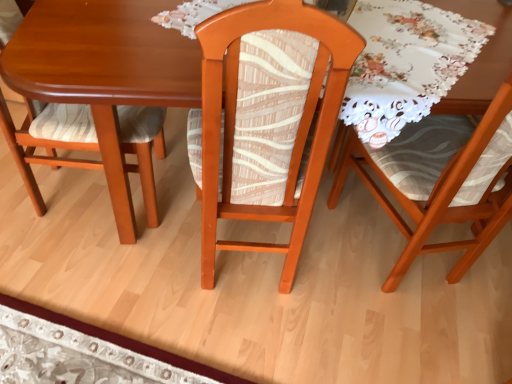
Measure the distance between point [471,220] and camera.

4.64 feet.

The width and height of the screenshot is (512, 384). Describe the element at coordinates (442, 180) in the screenshot. I see `wooden chair at right, positioned as the 1th chair in right-to-left order` at that location.

Identify the location of wooden table at center. This screenshot has height=384, width=512. (104, 70).

Describe the element at coordinates (141, 147) in the screenshot. The height and width of the screenshot is (384, 512). I see `matte wood chair at left, the 1th chair in the left-to-right sequence` at that location.

The image size is (512, 384). Find the location of `wooden chair at right, positioned as the 1th chair in right-to-left order`. wooden chair at right, positioned as the 1th chair in right-to-left order is located at coordinates (442, 180).

From a real-world perspective, is wooden chair at center, which appears as the second chair when viewed from the right, above or below wooden chair at right, which ranks as the 3th chair in left-to-right order?

wooden chair at center, which appears as the second chair when viewed from the right, is situated lower than wooden chair at right, which ranks as the 3th chair in left-to-right order, in the real world.

Consider the image. Is wooden chair at center, which appears as the second chair when viewed from the right, beside wooden chair at right, which ranks as the 3th chair in left-to-right order?

No, wooden chair at center, which appears as the second chair when viewed from the right, is not in contact with wooden chair at right, which ranks as the 3th chair in left-to-right order.

How different are the orientations of wooden chair at center, which appears as the second chair when viewed from the right, and wooden chair at right, which ranks as the 3th chair in left-to-right order, in degrees?

12 degrees.

From the image's perspective, which object appears higher, wooden table at center or matte wood chair at left, positioned as the 3th chair in right-to-left order?

From the image's view, wooden table at center is above.

Is wooden table at center not near matte wood chair at left, positioned as the 3th chair in right-to-left order?

No, wooden table at center is not far away from matte wood chair at left, positioned as the 3th chair in right-to-left order.

Is wooden table at center at the right side of matte wood chair at left, positioned as the 3th chair in right-to-left order?

Correct, you'll find wooden table at center to the right of matte wood chair at left, positioned as the 3th chair in right-to-left order.

In the scene shown: Is wooden table at center shorter than matte wood chair at left, the 1th chair in the left-to-right sequence?

Yes, wooden table at center is shorter than matte wood chair at left, the 1th chair in the left-to-right sequence.

Consider the image. From the image's perspective, is wooden table at center positioned above or below wooden chair at right, which ranks as the 3th chair in left-to-right order?

From the image's perspective, wooden table at center appears above wooden chair at right, which ranks as the 3th chair in left-to-right order.

Which object is more forward, wooden table at center or wooden chair at right, positioned as the 1th chair in right-to-left order?

wooden chair at right, positioned as the 1th chair in right-to-left order.

Which of these two, wooden table at center or wooden chair at right, positioned as the 1th chair in right-to-left order, is smaller?

With smaller size is wooden table at center.

Is matte wood chair at left, the 1th chair in the left-to-right sequence, shorter than wooden table at center?

No, matte wood chair at left, the 1th chair in the left-to-right sequence, is not shorter than wooden table at center.

Considering the positions of objects matte wood chair at left, the 1th chair in the left-to-right sequence, and wooden table at center in the image provided, who is more to the left, matte wood chair at left, the 1th chair in the left-to-right sequence, or wooden table at center?

Positioned to the left is matte wood chair at left, the 1th chair in the left-to-right sequence.

Is matte wood chair at left, the 1th chair in the left-to-right sequence, positioned with its back to wooden table at center?

That's not correct — matte wood chair at left, the 1th chair in the left-to-right sequence, is not looking away from wooden table at center.

Which is in front, matte wood chair at left, positioned as the 3th chair in right-to-left order, or wooden table at center?

wooden table at center is closer to the camera.

Considering the points (175, 80) and (302, 50), which point is in front, point (175, 80) or point (302, 50)?

Positioned in front is point (302, 50).

Can you confirm if wooden table at center is positioned to the right of wooden chair at center, which appears as the second chair when viewed from the right?

Yes, wooden table at center is to the right of wooden chair at center, which appears as the second chair when viewed from the right.

Who is smaller, wooden table at center or wooden chair at center, marked as the second chair in a left-to-right arrangement?

Smaller between the two is wooden table at center.

From the image's perspective, is wooden table at center below wooden chair at center, which appears as the second chair when viewed from the right?

No, from the image's perspective, wooden table at center is not below wooden chair at center, which appears as the second chair when viewed from the right.

Who is bigger, wooden chair at center, marked as the second chair in a left-to-right arrangement, or wooden table at center?

wooden chair at center, marked as the second chair in a left-to-right arrangement, is bigger.

Which object is closer to the camera, wooden chair at center, marked as the second chair in a left-to-right arrangement, or wooden table at center?

Positioned in front is wooden chair at center, marked as the second chair in a left-to-right arrangement.

Could you tell me if wooden chair at center, which appears as the second chair when viewed from the right, is facing wooden table at center?

No.

Between matte wood chair at left, the 1th chair in the left-to-right sequence, and wooden chair at right, positioned as the 1th chair in right-to-left order, which one appears on the left side from the viewer's perspective?

matte wood chair at left, the 1th chair in the left-to-right sequence.

From a real-world perspective, between matte wood chair at left, the 1th chair in the left-to-right sequence, and wooden chair at right, which ranks as the 3th chair in left-to-right order, who is vertically higher?

wooden chair at right, which ranks as the 3th chair in left-to-right order, is physically above.

Which of these two, matte wood chair at left, positioned as the 3th chair in right-to-left order, or wooden chair at right, which ranks as the 3th chair in left-to-right order, is wider?

Wider between the two is matte wood chair at left, positioned as the 3th chair in right-to-left order.

From a real-world perspective, count 1st chairs downward from the wooden chair at right, which ranks as the 3th chair in left-to-right order, and point to it. Please provide its 2D coordinates.

[(268, 118)]

From the image's perspective, count 1st chairs downward from the wooden table at center and point to it. Please provide its 2D coordinates.

[(141, 147)]

When comparing their distances from wooden chair at right, positioned as the 1th chair in right-to-left order, does wooden table at center or matte wood chair at left, positioned as the 3th chair in right-to-left order, seem further?

Based on the image, matte wood chair at left, positioned as the 3th chair in right-to-left order, appears to be further to wooden chair at right, positioned as the 1th chair in right-to-left order.

Looking at the image, which one is located closer to wooden chair at right, positioned as the 1th chair in right-to-left order, matte wood chair at left, positioned as the 3th chair in right-to-left order, or wooden table at center?

Based on the image, wooden table at center appears to be nearer to wooden chair at right, positioned as the 1th chair in right-to-left order.

Considering their positions, is matte wood chair at left, positioned as the 3th chair in right-to-left order, positioned further to wooden table at center than wooden chair at right, positioned as the 1th chair in right-to-left order?

wooden chair at right, positioned as the 1th chair in right-to-left order.

From the image, which object appears to be farther from matte wood chair at left, the 1th chair in the left-to-right sequence, wooden chair at right, positioned as the 1th chair in right-to-left order, or wooden chair at center, which appears as the second chair when viewed from the right?

wooden chair at right, positioned as the 1th chair in right-to-left order, is positioned further to the anchor matte wood chair at left, the 1th chair in the left-to-right sequence.

When comparing their distances from wooden table at center, does wooden chair at center, which appears as the second chair when viewed from the right, or wooden chair at right, positioned as the 1th chair in right-to-left order, seem further?

Among the two, wooden chair at right, positioned as the 1th chair in right-to-left order, is located further to wooden table at center.

Based on the photo, considering their positions, is wooden chair at right, which ranks as the 3th chair in left-to-right order, positioned further to wooden chair at center, which appears as the second chair when viewed from the right, than wooden table at center?

Among the two, wooden chair at right, which ranks as the 3th chair in left-to-right order, is located further to wooden chair at center, which appears as the second chair when viewed from the right.

Which object lies further to the anchor point wooden chair at center, which appears as the second chair when viewed from the right, wooden chair at right, which ranks as the 3th chair in left-to-right order, or matte wood chair at left, the 1th chair in the left-to-right sequence?

Based on the image, wooden chair at right, which ranks as the 3th chair in left-to-right order, appears to be further to wooden chair at center, which appears as the second chair when viewed from the right.

Based on their spatial positions, is wooden chair at center, which appears as the second chair when viewed from the right, or wooden table at center further from matte wood chair at left, the 1th chair in the left-to-right sequence?

wooden chair at center, which appears as the second chair when viewed from the right, is positioned further to the anchor matte wood chair at left, the 1th chair in the left-to-right sequence.

Locate an element on the screen. The width and height of the screenshot is (512, 384). chair situated between matte wood chair at left, positioned as the 3th chair in right-to-left order, and wooden chair at right, which ranks as the 3th chair in left-to-right order, from left to right is located at coordinates (268, 118).

You are a GUI agent. You are given a task and a screenshot of the screen. Output one action in this format:
    pyautogui.click(x=<x>, y=<y>)
    Task: Click on the chair situated between matte wood chair at left, positioned as the 3th chair in right-to-left order, and wooden table at center from left to right
    The height and width of the screenshot is (384, 512).
    Given the screenshot: What is the action you would take?
    pyautogui.click(x=268, y=118)

Locate an element on the screen. The width and height of the screenshot is (512, 384). table between matte wood chair at left, the 1th chair in the left-to-right sequence, and wooden chair at right, positioned as the 1th chair in right-to-left order, in the horizontal direction is located at coordinates [104, 70].

I want to click on table between wooden chair at center, marked as the second chair in a left-to-right arrangement, and wooden chair at right, which ranks as the 3th chair in left-to-right order, from left to right, so click(104, 70).